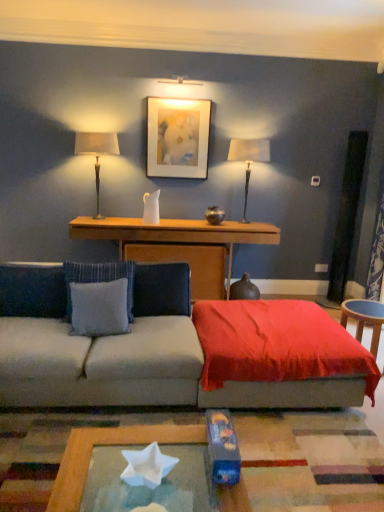
Question: From the image's perspective, would you say velvet red throw at center is positioned over blue fabric pillow at left, the 1th pillow from the left?

Choices:
 (A) no
 (B) yes

Answer: (A)

Question: From the image's perspective, would you say velvet red throw at center is shown under blue fabric pillow at left, the 1th pillow from the left?

Choices:
 (A) no
 (B) yes

Answer: (B)

Question: Is velvet red throw at center to the right of blue fabric pillow at left, acting as the 3th pillow starting from the right, from the viewer's perspective?

Choices:
 (A) yes
 (B) no

Answer: (A)

Question: Is velvet red throw at center at the left side of blue fabric pillow at left, acting as the 3th pillow starting from the right?

Choices:
 (A) no
 (B) yes

Answer: (A)

Question: Is velvet red throw at center bigger than blue fabric pillow at left, acting as the 3th pillow starting from the right?

Choices:
 (A) yes
 (B) no

Answer: (A)

Question: Is velvet red throw at center with blue fabric pillow at left, acting as the 3th pillow starting from the right?

Choices:
 (A) no
 (B) yes

Answer: (A)

Question: Is satin beige lampshade at left, which is counted as the 1th table lamp, starting from the left, completely or partially outside of matte white picture frame at upper center?

Choices:
 (A) yes
 (B) no

Answer: (A)

Question: Does satin beige lampshade at left, which is counted as the 1th table lamp, starting from the left, appear on the right side of matte white picture frame at upper center?

Choices:
 (A) yes
 (B) no

Answer: (B)

Question: Is satin beige lampshade at left, marked as the 2th table lamp in a right-to-left arrangement, taller than matte white picture frame at upper center?

Choices:
 (A) yes
 (B) no

Answer: (A)

Question: Can you confirm if satin beige lampshade at left, marked as the 2th table lamp in a right-to-left arrangement, is wider than matte white picture frame at upper center?

Choices:
 (A) no
 (B) yes

Answer: (B)

Question: From the image's perspective, is satin beige lampshade at left, which is counted as the 1th table lamp, starting from the left, below matte white picture frame at upper center?

Choices:
 (A) no
 (B) yes

Answer: (B)

Question: Considering the relative positions of matte white picture frame at upper center and blue fabric pillow at left, the 1th pillow from the left, in the image provided, is matte white picture frame at upper center to the left of blue fabric pillow at left, the 1th pillow from the left, from the viewer's perspective?

Choices:
 (A) yes
 (B) no

Answer: (B)